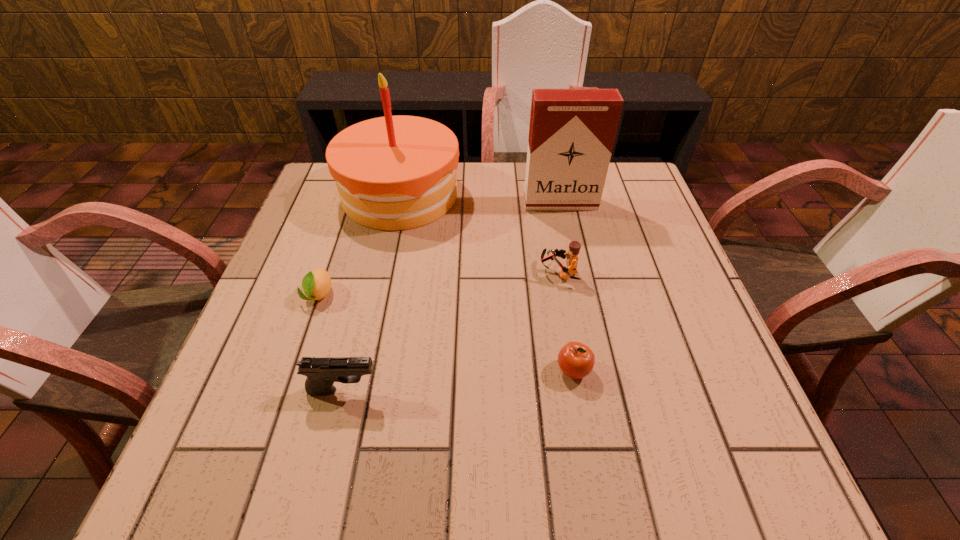
What are the coordinates of `object present at the far left corner` in the screenshot? It's located at (392, 173).

You are a GUI agent. You are given a task and a screenshot of the screen. Output one action in this format:
    pyautogui.click(x=<x>, y=<y>)
    Task: Click on the object located in the far right corner section of the desktop
    This screenshot has width=960, height=540.
    Given the screenshot: What is the action you would take?
    pyautogui.click(x=572, y=131)

You are a GUI agent. You are given a task and a screenshot of the screen. Output one action in this format:
    pyautogui.click(x=<x>, y=<y>)
    Task: Click on the vacant space at the far edge
    
    Given the screenshot: What is the action you would take?
    click(x=469, y=203)

At what (x,y) coordinates should I click in order to perform the action: click on vacant space at the near edge of the desktop. Please return your answer as a coordinate pair (x, y). The height and width of the screenshot is (540, 960). Looking at the image, I should click on (393, 437).

You are a GUI agent. You are given a task and a screenshot of the screen. Output one action in this format:
    pyautogui.click(x=<x>, y=<y>)
    Task: Click on the free space at the left edge of the desktop
    The width and height of the screenshot is (960, 540).
    Given the screenshot: What is the action you would take?
    pyautogui.click(x=240, y=389)

Locate an element on the screen. Image resolution: width=960 pixels, height=540 pixels. vacant space at the right edge of the desktop is located at coordinates (679, 259).

I want to click on vacant space at the far left corner of the desktop, so (x=326, y=207).

At what (x,y) coordinates should I click in order to perform the action: click on free space at the far right corner. Please return your answer as a coordinate pair (x, y). The height and width of the screenshot is (540, 960). Looking at the image, I should click on (631, 185).

You are a GUI agent. You are given a task and a screenshot of the screen. Output one action in this format:
    pyautogui.click(x=<x>, y=<y>)
    Task: Click on the free space that is in between the birthday cake and the pistol
    The image size is (960, 540).
    Given the screenshot: What is the action you would take?
    pyautogui.click(x=372, y=292)

At what (x,y) coordinates should I click in order to perform the action: click on free space between the birthday cake and the shortest object. Please return your answer as a coordinate pair (x, y). Image resolution: width=960 pixels, height=540 pixels. Looking at the image, I should click on (359, 245).